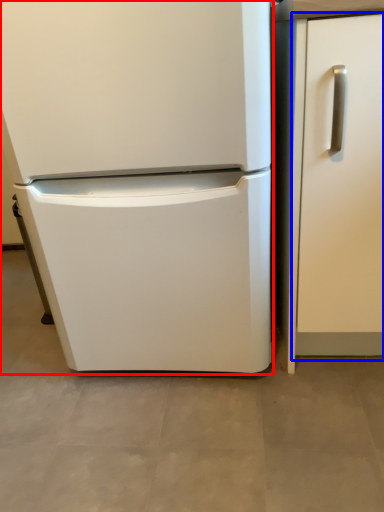
Question: Which object appears farthest to the camera in this image, refrigerator (highlighted by a red box) or door (highlighted by a blue box)?

Choices:
 (A) refrigerator
 (B) door

Answer: (B)